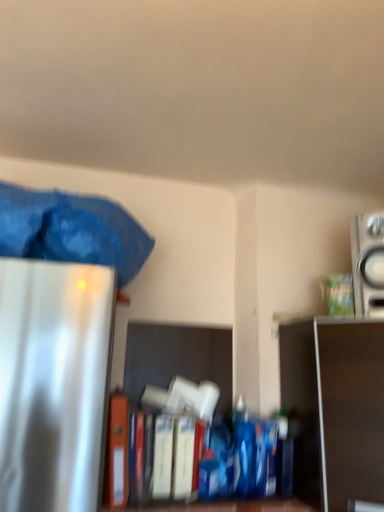
Question: Does metallic silver shelf at right lie in front of silver metallic speaker at upper right?

Choices:
 (A) yes
 (B) no

Answer: (A)

Question: From a real-world perspective, is metallic silver shelf at right beneath silver metallic speaker at upper right?

Choices:
 (A) yes
 (B) no

Answer: (A)

Question: Is metallic silver shelf at right wider than silver metallic speaker at upper right?

Choices:
 (A) no
 (B) yes

Answer: (B)

Question: Would you say metallic silver shelf at right is outside silver metallic speaker at upper right?

Choices:
 (A) no
 (B) yes

Answer: (B)

Question: Is metallic silver shelf at right taller than silver metallic speaker at upper right?

Choices:
 (A) no
 (B) yes

Answer: (B)

Question: Is metallic silver shelf at right next to silver metallic speaker at upper right?

Choices:
 (A) yes
 (B) no

Answer: (B)

Question: Is metallic silver shelf at right located outside orange matte file folder at center?

Choices:
 (A) yes
 (B) no

Answer: (A)

Question: Is metallic silver shelf at right looking in the opposite direction of orange matte file folder at center?

Choices:
 (A) yes
 (B) no

Answer: (B)

Question: From the image's perspective, would you say metallic silver shelf at right is shown under orange matte file folder at center?

Choices:
 (A) yes
 (B) no

Answer: (B)

Question: Is metallic silver shelf at right positioned before orange matte file folder at center?

Choices:
 (A) yes
 (B) no

Answer: (A)

Question: From a real-world perspective, is metallic silver shelf at right below orange matte file folder at center?

Choices:
 (A) yes
 (B) no

Answer: (B)

Question: Is metallic silver shelf at right directly adjacent to orange matte file folder at center?

Choices:
 (A) no
 (B) yes

Answer: (A)

Question: Is silver metallic speaker at upper right smaller than metallic silver shelf at right?

Choices:
 (A) no
 (B) yes

Answer: (B)